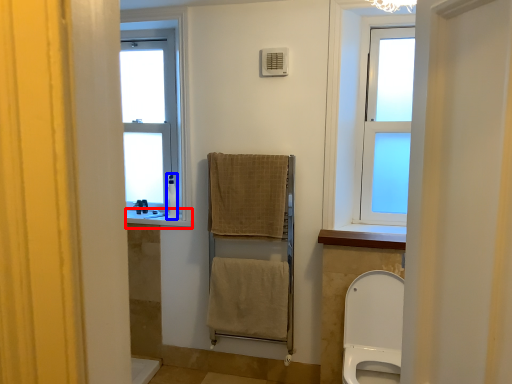
Question: Among these objects, which one is farthest to the camera, window sill (highlighted by a red box) or toiletry (highlighted by a blue box)?

Choices:
 (A) window sill
 (B) toiletry

Answer: (B)